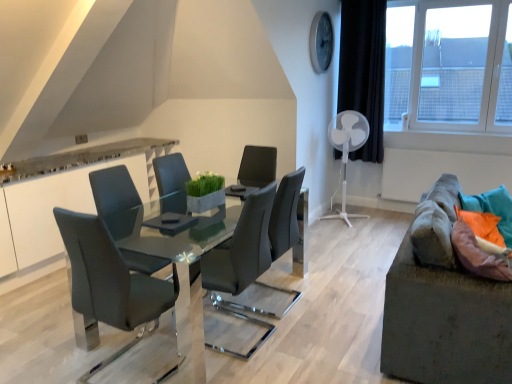
Question: Considering the positions of transparent glass window at upper right and matte gray chair at center, the 1th chair viewed from the right, in the image, is transparent glass window at upper right wider or thinner than matte gray chair at center, the 1th chair viewed from the right,?

Choices:
 (A) thin
 (B) wide

Answer: (A)

Question: Does point (396, 23) appear closer or farther from the camera than point (249, 269)?

Choices:
 (A) closer
 (B) farther

Answer: (B)

Question: Which object is positioned closest to the black fabric curtain at upper right?

Choices:
 (A) white plastic mechanical fan at right
 (B) matte gray chair at left, which is the 2th chair from back to front
 (C) matte gray chair at center, which is the second chair in front-to-back order
 (D) textured gray couch at right
 (E) glossy glass table at center

Answer: (A)

Question: Based on their relative distances, which object is farther from the matte gray chair at center, the first chair in the back-to-front sequence?

Choices:
 (A) white plastic mechanical fan at right
 (B) matte gray chair at left, positioned as the 2th chair in right-to-left order
 (C) transparent glass window at upper right
 (D) black fabric curtain at upper right
 (E) orange fabric pillow at right

Answer: (C)